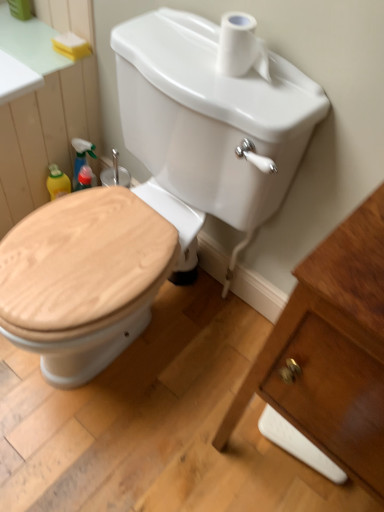
Question: Is wooden toilet seat at center facing away from yellow sponge at upper left?

Choices:
 (A) yes
 (B) no

Answer: (B)

Question: Are wooden toilet seat at center and yellow sponge at upper left beside each other?

Choices:
 (A) yes
 (B) no

Answer: (B)

Question: Are wooden toilet seat at center and yellow sponge at upper left located far from each other?

Choices:
 (A) no
 (B) yes

Answer: (A)

Question: Is wooden toilet seat at center surrounding yellow sponge at upper left?

Choices:
 (A) no
 (B) yes

Answer: (A)

Question: Considering the relative sizes of wooden toilet seat at center and yellow sponge at upper left in the image provided, is wooden toilet seat at center thinner than yellow sponge at upper left?

Choices:
 (A) no
 (B) yes

Answer: (A)

Question: From a real-world perspective, is yellow sponge at upper left above or below white matte toilet paper at upper center?

Choices:
 (A) below
 (B) above

Answer: (A)

Question: Considering the relative positions of yellow sponge at upper left and white matte toilet paper at upper center in the image provided, is yellow sponge at upper left to the left or to the right of white matte toilet paper at upper center?

Choices:
 (A) left
 (B) right

Answer: (A)

Question: Is point click(66, 41) positioned closer to the camera than point click(230, 13)?

Choices:
 (A) closer
 (B) farther

Answer: (B)

Question: Is yellow sponge at upper left spatially inside white matte toilet paper at upper center, or outside of it?

Choices:
 (A) outside
 (B) inside

Answer: (A)

Question: Does point (175, 110) appear closer or farther from the camera than point (256, 70)?

Choices:
 (A) closer
 (B) farther

Answer: (B)

Question: Would you say wooden toilet seat at center is to the left or to the right of white matte toilet paper at upper center in the picture?

Choices:
 (A) right
 (B) left

Answer: (B)

Question: Is wooden toilet seat at center taller or shorter than white matte toilet paper at upper center?

Choices:
 (A) short
 (B) tall

Answer: (B)

Question: Is wooden toilet seat at center in front of or behind white matte toilet paper at upper center in the image?

Choices:
 (A) behind
 (B) front

Answer: (B)

Question: From the image's perspective, is white matte toilet paper at upper center located above or below wooden toilet seat at center?

Choices:
 (A) above
 (B) below

Answer: (A)

Question: Looking at their shapes, would you say white matte toilet paper at upper center is wider or thinner than wooden toilet seat at center?

Choices:
 (A) wide
 (B) thin

Answer: (B)